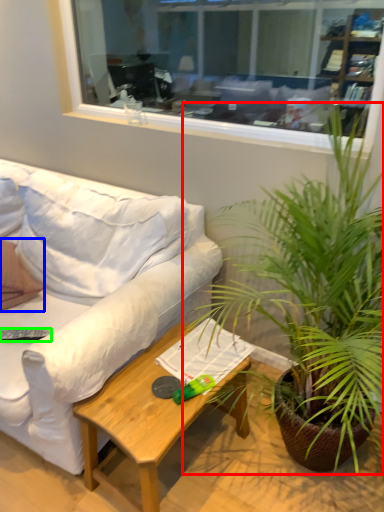
Question: Considering the real-world distances, which object is closest to houseplant (highlighted by a red box)? pillow (highlighted by a blue box) or remote control (highlighted by a green box).

Choices:
 (A) pillow
 (B) remote control

Answer: (B)